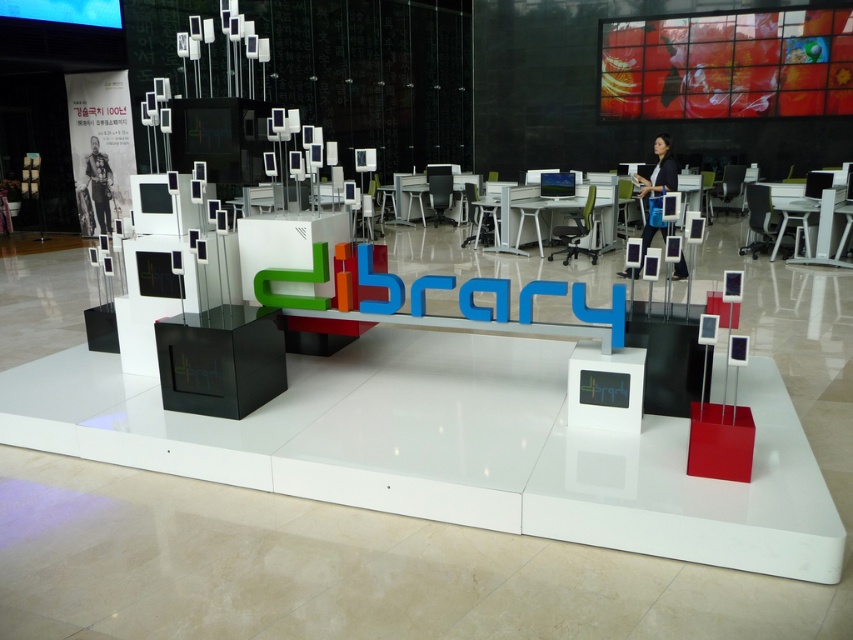
Is point (759, 220) positioned after point (479, 211)?

No, it is in front of (479, 211).

Does black plastic chair at right have a lesser height compared to matte white chair at center?

Yes.

Which is in front, point (772, 227) or point (482, 196)?

Positioned in front is point (772, 227).

Locate an element on the screen. This screenshot has height=640, width=853. black plastic chair at right is located at coordinates click(x=759, y=220).

Is matte black chair at center above white plastic chair at center?

Actually, matte black chair at center is below white plastic chair at center.

Between matte black chair at center and white plastic chair at center, which one is positioned higher?

white plastic chair at center

Where is `matte black chair at center`? This screenshot has height=640, width=853. matte black chair at center is located at coordinates (728, 189).

Identify the location of matte white chair at center. (480, 218).

Is matte white chair at center smaller than green fabric chair at center?

Correct, matte white chair at center occupies less space than green fabric chair at center.

Is point (468, 195) positioned after point (578, 237)?

Yes, point (468, 195) is farther from viewer.

Find the location of a particular element. matte white chair at center is located at coordinates (480, 218).